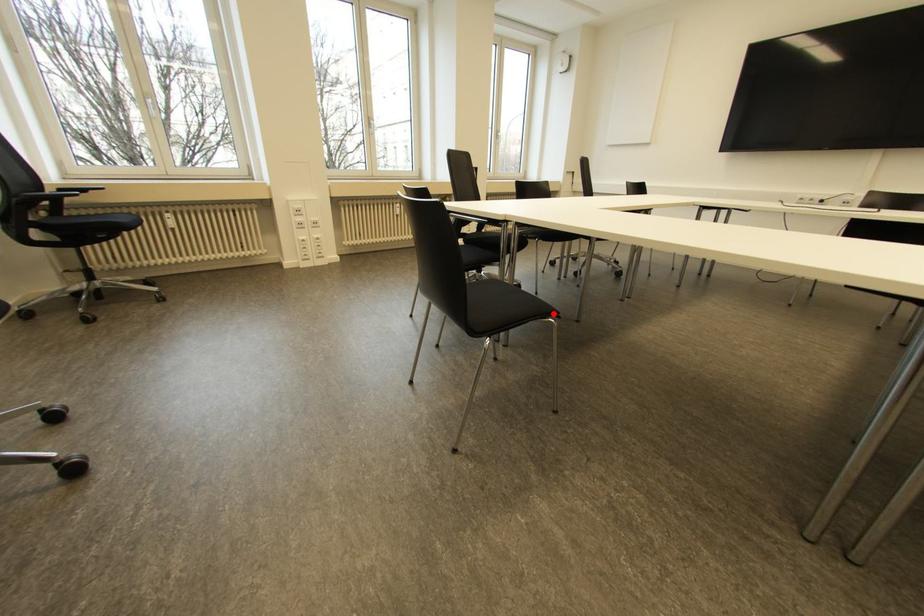
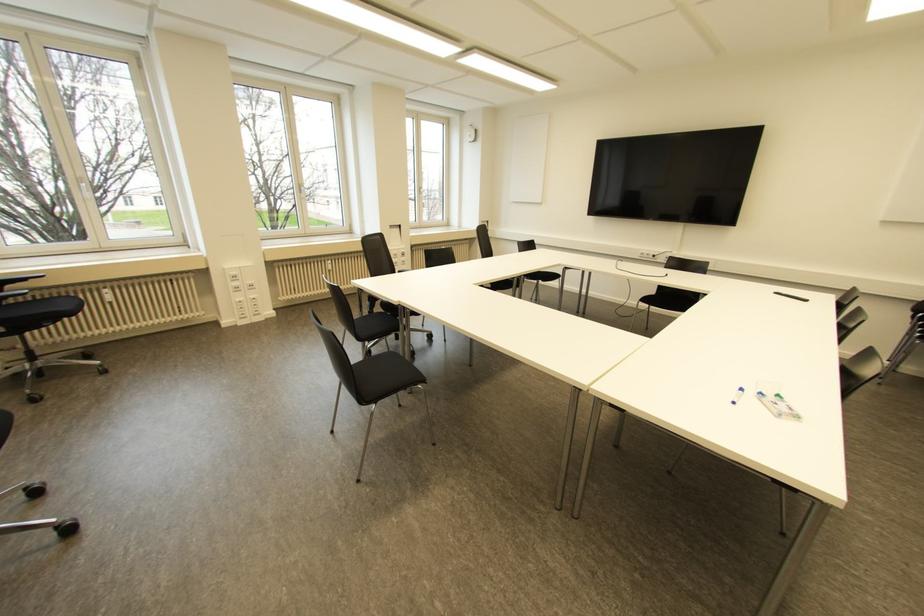
In the second image, find the point that corresponds to the highlighted location in the first image.

(422, 381)